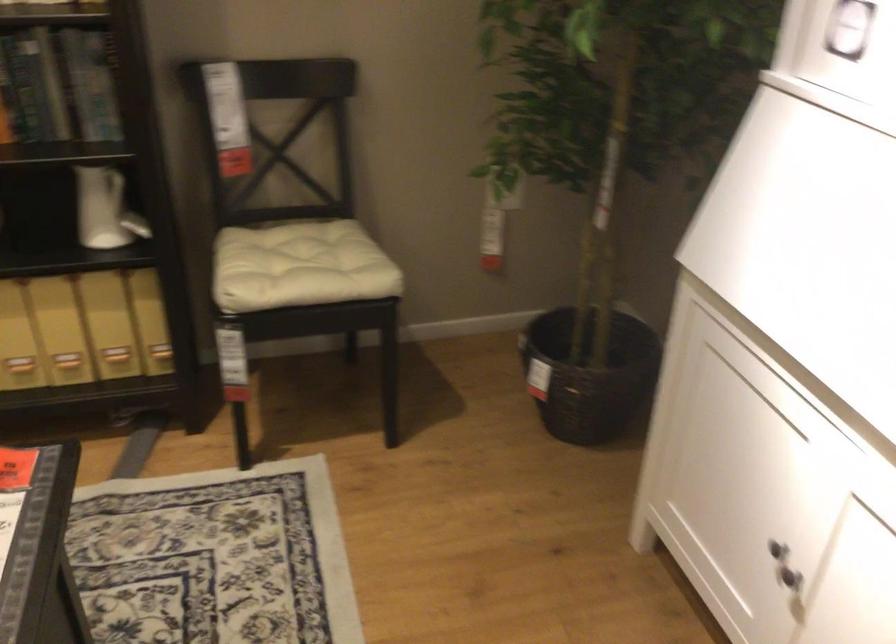
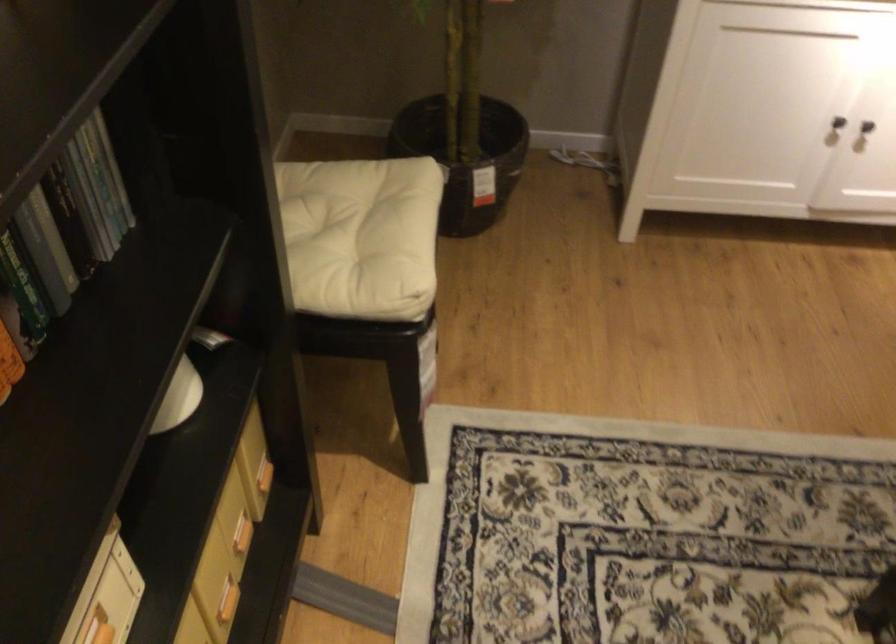
Where in the second image is the point corresponding to (x=170, y=350) from the first image?

(263, 476)